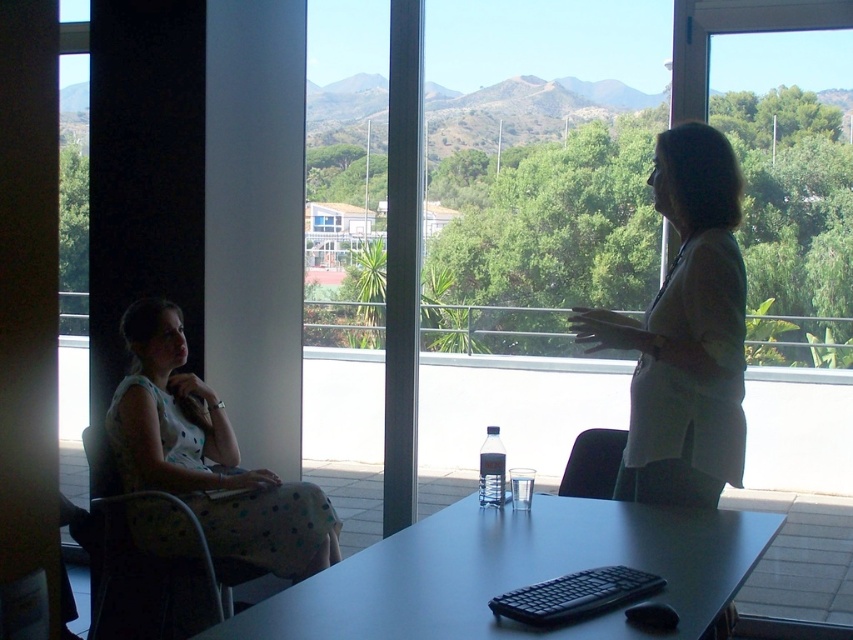
Based on the photo, is smooth matte black table at center positioned at the back of black plastic chair at lower center?

No, smooth matte black table at center is in front of black plastic chair at lower center.

Identify the location of smooth matte black table at center. The height and width of the screenshot is (640, 853). (515, 572).

Does white fabric shirt at upper right appear under white dotted dress at left?

No, white fabric shirt at upper right is not below white dotted dress at left.

Can you confirm if white fabric shirt at upper right is smaller than white dotted dress at left?

Yes, white fabric shirt at upper right is smaller than white dotted dress at left.

Is point (720, 284) closer to camera compared to point (167, 417)?

Yes, point (720, 284) is in front of point (167, 417).

Locate an element on the screen. This screenshot has height=640, width=853. white fabric shirt at upper right is located at coordinates (685, 333).

Based on the photo, can you confirm if white fabric shirt at upper right is thinner than polka dot fabric chair at left?

Indeed, white fabric shirt at upper right has a lesser width compared to polka dot fabric chair at left.

Does white fabric shirt at upper right appear on the right side of polka dot fabric chair at left?

Indeed, white fabric shirt at upper right is positioned on the right side of polka dot fabric chair at left.

The image size is (853, 640). Identify the location of white fabric shirt at upper right. (685, 333).

Find the location of a particular element. This screenshot has height=640, width=853. white fabric shirt at upper right is located at coordinates (685, 333).